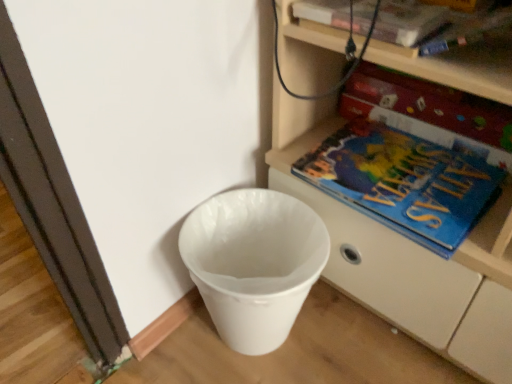
Question: Considering the positions of blue matte paperback book at right, arranged as the 2th paperback book when viewed from the front, and blue matte atlas at lower right in the image, is blue matte paperback book at right, arranged as the 2th paperback book when viewed from the front, taller or shorter than blue matte atlas at lower right?

Choices:
 (A) short
 (B) tall

Answer: (B)

Question: Relative to blue matte atlas at lower right, is blue matte paperback book at right, which is the first paperback book in bottom-to-top order, in front or behind?

Choices:
 (A) behind
 (B) front

Answer: (A)

Question: Estimate the real-world distances between objects in this image. Which object is farther from the blue matte paperback book at right, the 1th paperback book viewed from the back?

Choices:
 (A) white plastic waste bin at lower left
 (B) white plastic shelf at lower right
 (C) hardcover book at upper center, which appears as the 1th paperback book when viewed from the top
 (D) blue matte atlas at lower right

Answer: (A)

Question: Estimate the real-world distances between objects in this image. Which object is closer to the blue matte atlas at lower right?

Choices:
 (A) white plastic shelf at lower right
 (B) white plastic waste bin at lower left
 (C) blue matte paperback book at right, which ranks as the 2th paperback book in top-to-bottom order
 (D) hardcover book at upper center, positioned as the first paperback book in front-to-back order

Answer: (A)